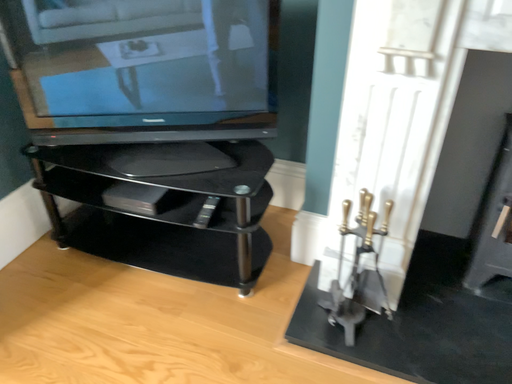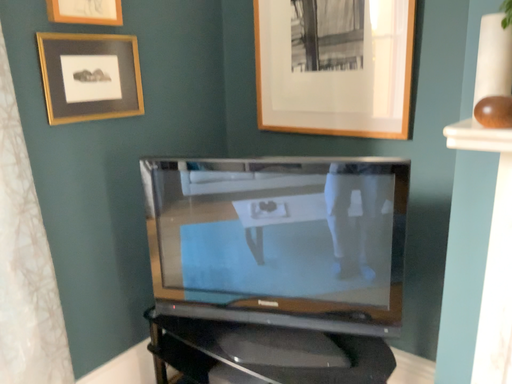
Question: Which way did the camera rotate in the video?

Choices:
 (A) rotated upward
 (B) rotated downward

Answer: (A)